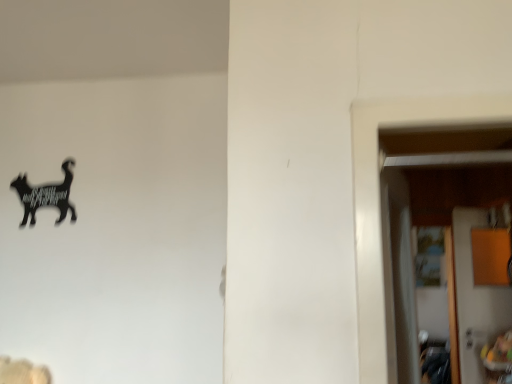
Question: From the image's perspective, is black matte cat at upper left located above or below wooden door at right?

Choices:
 (A) above
 (B) below

Answer: (A)

Question: From a real-world perspective, relative to wooden door at right, is black matte cat at upper left vertically above or below?

Choices:
 (A) below
 (B) above

Answer: (B)

Question: Is black matte cat at upper left wider or thinner than wooden door at right?

Choices:
 (A) wide
 (B) thin

Answer: (B)

Question: Looking at their shapes, would you say wooden door at right is wider or thinner than black matte cat at upper left?

Choices:
 (A) thin
 (B) wide

Answer: (B)

Question: Relative to black matte cat at upper left, is wooden door at right in front or behind?

Choices:
 (A) behind
 (B) front

Answer: (A)

Question: Looking at the image, does wooden door at right seem bigger or smaller compared to black matte cat at upper left?

Choices:
 (A) small
 (B) big

Answer: (B)

Question: From the image's perspective, relative to black matte cat at upper left, is wooden door at right above or below?

Choices:
 (A) above
 (B) below

Answer: (B)